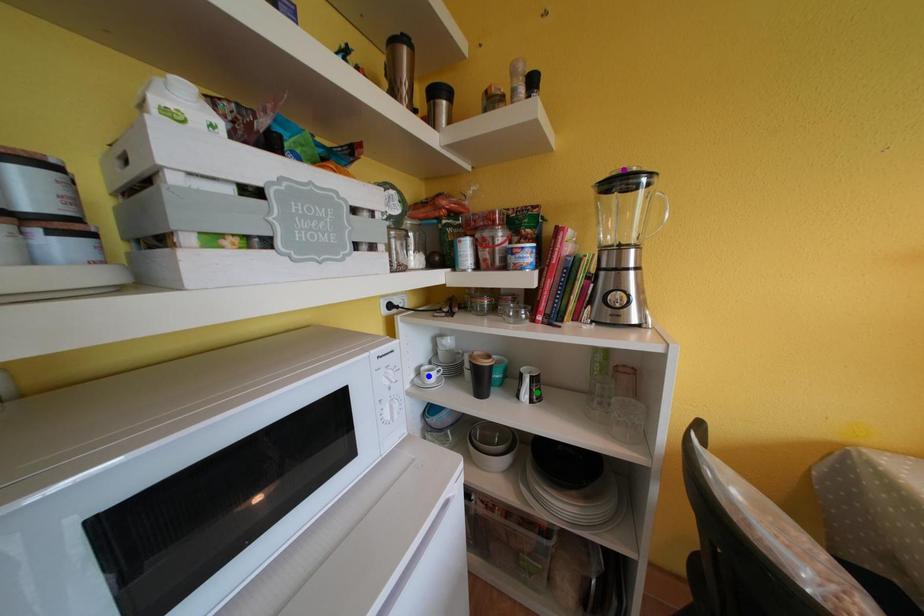
Looking at this image, order these from nearest to farthest:
purple point
green point
blue point

purple point → green point → blue point